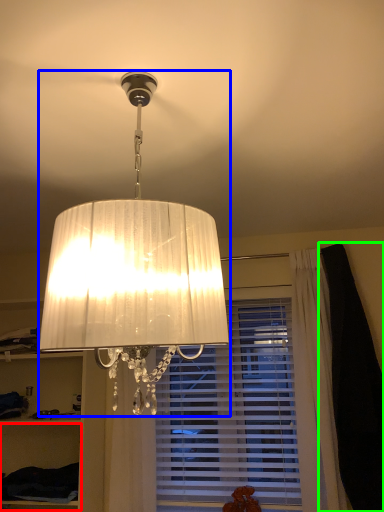
Question: Which is nearer to the cabinet (highlighted by a red box)? lamp (highlighted by a blue box) or dark (highlighted by a green box).

Choices:
 (A) lamp
 (B) dark

Answer: (B)